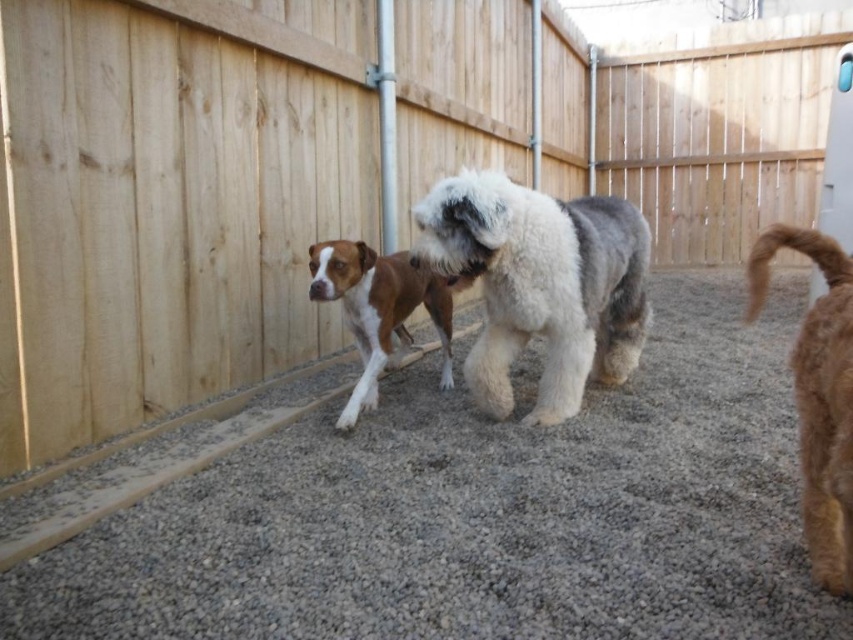
Question: Which object appears farthest from the camera in this image?

Choices:
 (A) brown/white fur dog at center
 (B) brown furry tail at right

Answer: (A)

Question: Can you confirm if brown furry tail at right is positioned above brown/white fur dog at center?

Choices:
 (A) no
 (B) yes

Answer: (A)

Question: Which point is closer to the camera?

Choices:
 (A) gray gravel at center
 (B) brown/white fur dog at center
 (C) brown furry tail at right

Answer: (C)

Question: Can you confirm if gray gravel at center is positioned to the left of brown furry tail at right?

Choices:
 (A) no
 (B) yes

Answer: (B)

Question: Does white fluffy dog at center have a smaller size compared to brown furry tail at right?

Choices:
 (A) no
 (B) yes

Answer: (A)

Question: Which object is the farthest from the white fluffy dog at center?

Choices:
 (A) gray gravel at center
 (B) brown/white fur dog at center
 (C) brown furry tail at right

Answer: (C)